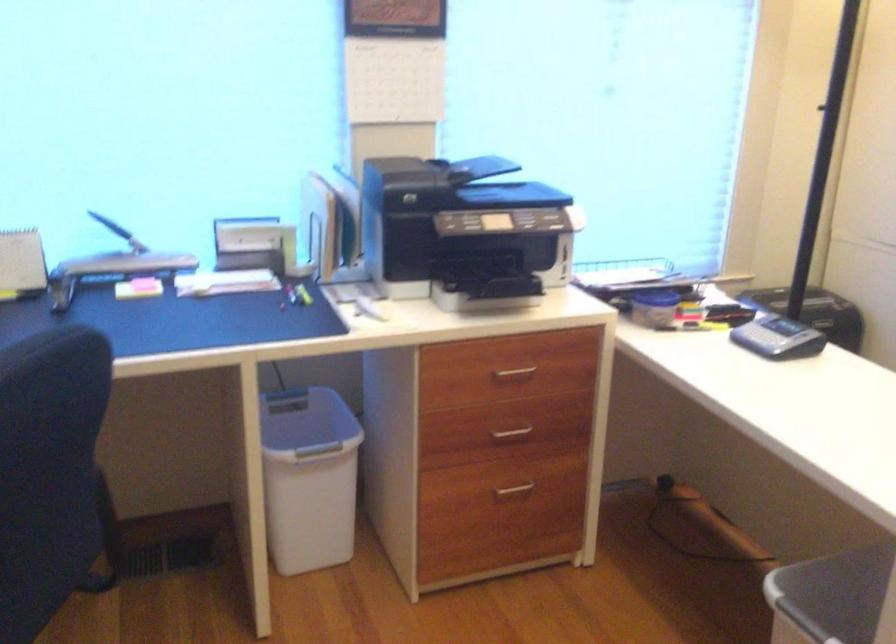
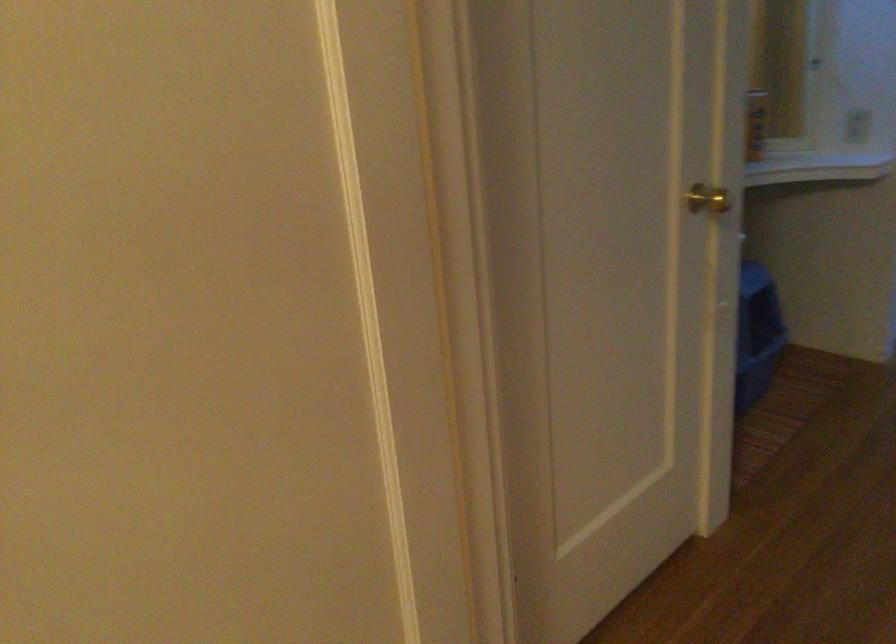
Which direction would the cameraman need to move to produce the second image?

The cameraman walked toward right, forward.